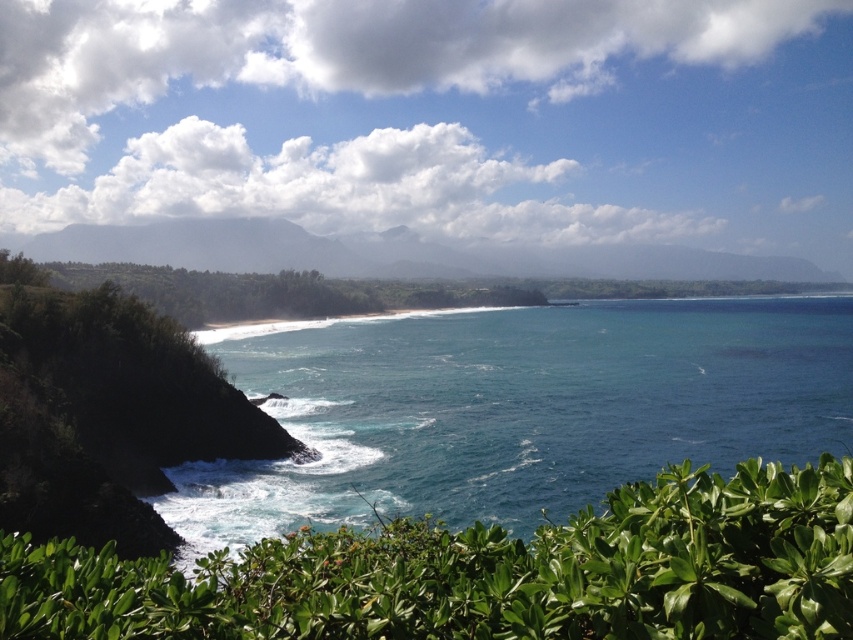
You are a photographer planning to capture a landscape photo of the coastal scene. You want to ensure the blue glossy water at center and the green leafy shrub at lower center are both visible in the frame. Based on their positions, which object should you place closer to the left side of your camera viewfinder?

The green leafy shrub at lower center should be placed closer to the left side of the camera viewfinder because the blue glossy water at center is positioned on the right side of it.